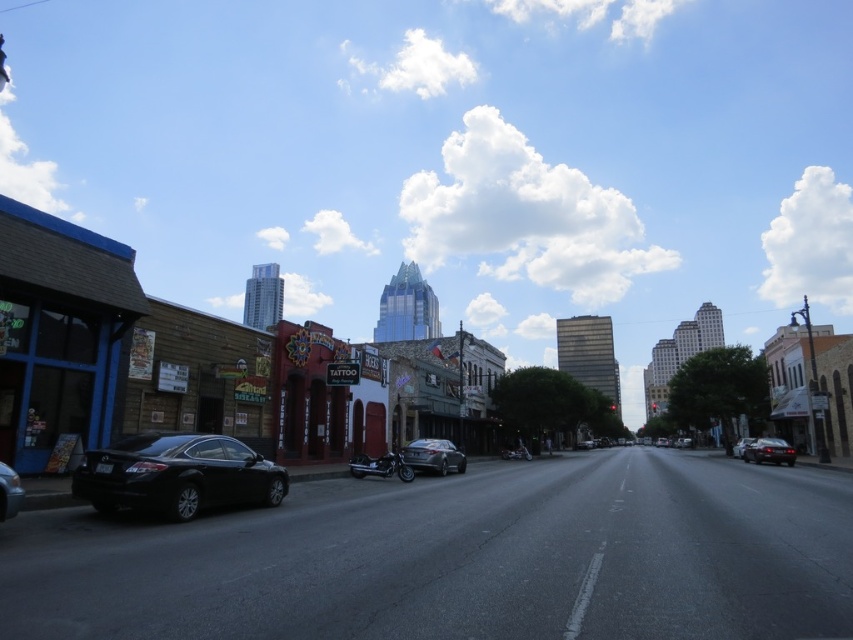
Question: Is black matte sedan at center to the right of black matte sedan at center-right from the viewer's perspective?

Choices:
 (A) yes
 (B) no

Answer: (B)

Question: Which of the following is the farthest from the observer?

Choices:
 (A) black matte sedan at center
 (B) black matte car at left

Answer: (A)

Question: Is satin silver sedan at center behind black matte sedan at center?

Choices:
 (A) yes
 (B) no

Answer: (B)

Question: Does shiny black sedan at lower left come behind black matte sedan at center-right?

Choices:
 (A) no
 (B) yes

Answer: (A)

Question: Which point is closer to the camera?

Choices:
 (A) black matte car at left
 (B) shiny black sedan at lower left

Answer: (B)

Question: Which is farther from the black matte car at left?

Choices:
 (A) black matte sedan at center
 (B) satin silver sedan at center

Answer: (A)